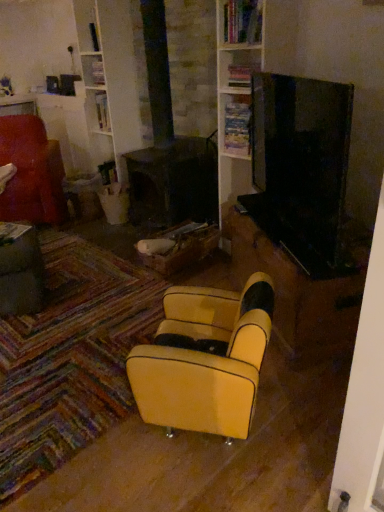
Find the location of a particular element. free location to the right of yellow leather chair at center, which is the 2th chair in top-to-bottom order is located at coordinates (302, 405).